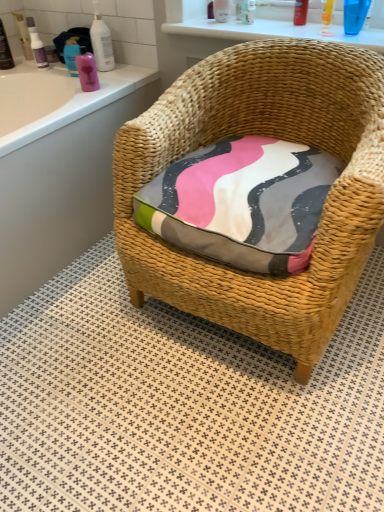
Locate an element on the screen. This screenshot has height=512, width=384. unoccupied region to the right of white glossy bottle at upper left, the sixth toiletry viewed from the left is located at coordinates (129, 69).